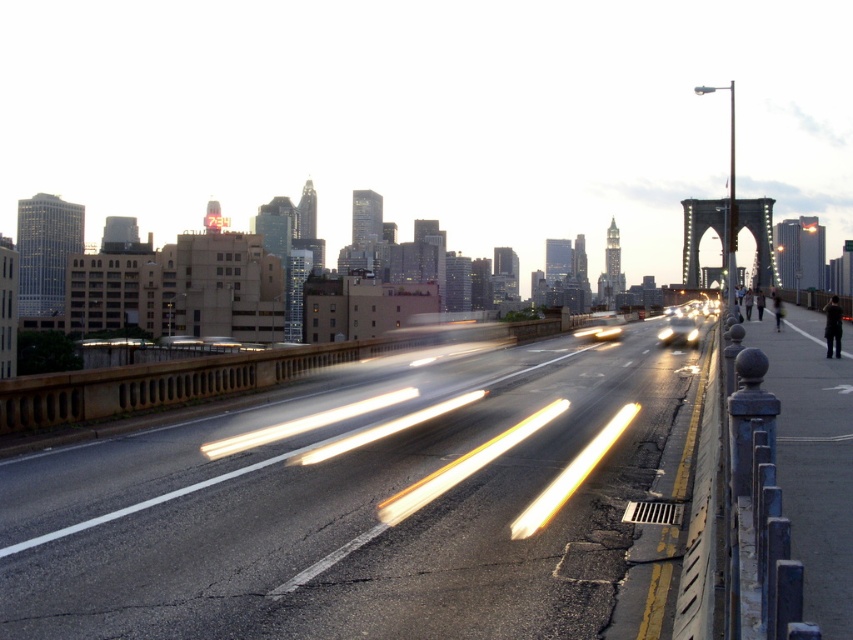
You are a photographer who wants to capture the metallic gray bridge at right and the yellow translucent light at center in a single shot. Based on their positions, which object should you focus on first to ensure both are in the frame?

The metallic gray bridge at right is located above the yellow translucent light at center, so you should focus on the metallic gray bridge at right first to ensure both are in the frame.

Based on the photo, you are a photographer planning to capture the metallic gray bridge at right and the shiny silver sedan at center in a single shot. Given their sizes in the image, which object will appear bigger in your photo?

The metallic gray bridge at right will appear bigger in the photo because it has a larger size compared to the shiny silver sedan at center.

You are standing on the bridge and want to take a photo of both point (699,212) and point (670,324). Which point will appear closer to the edge of the photo frame?

Point (699,212) is further to the camera than point (670,324), so in the photo frame, point (699,212) will appear closer to the edge of the photo frame.